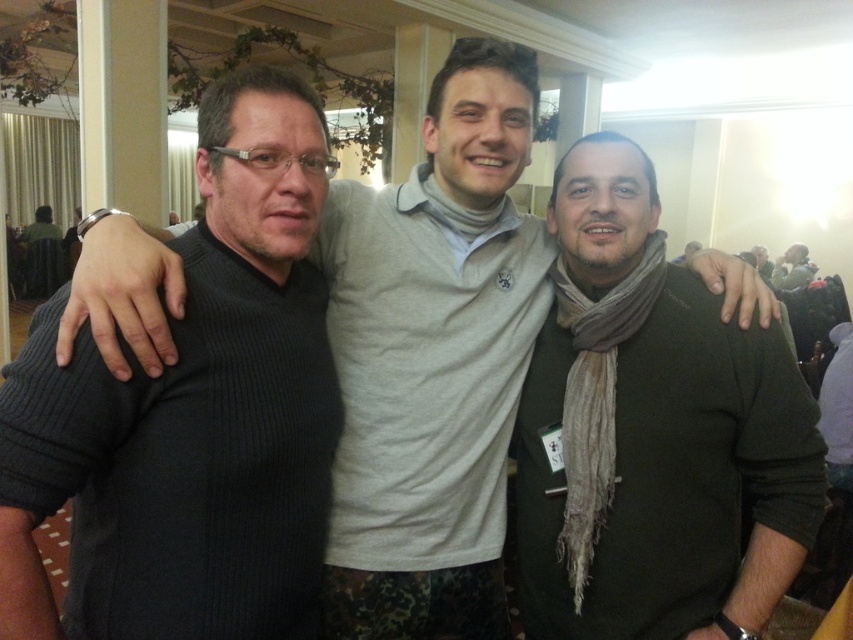
Question: Does dark green sweater at center appear under green textured scarf at center?

Choices:
 (A) no
 (B) yes

Answer: (B)

Question: Considering the real-world distances, which object is farthest from the green textured scarf at center?

Choices:
 (A) ribbed sweater at left
 (B) dark green sweater at center

Answer: (A)

Question: Which point appears closest to the camera in this image?

Choices:
 (A) (711, 582)
 (B) (776, 282)

Answer: (A)

Question: Can you confirm if ribbed sweater at left is thinner than dark green sweater at center?

Choices:
 (A) yes
 (B) no

Answer: (A)

Question: Which is nearer to the ribbed sweater at left?

Choices:
 (A) green textured scarf at center
 (B) dark green sweater at center

Answer: (B)

Question: Is ribbed sweater at left closer to camera compared to green textured scarf at center?

Choices:
 (A) no
 (B) yes

Answer: (B)